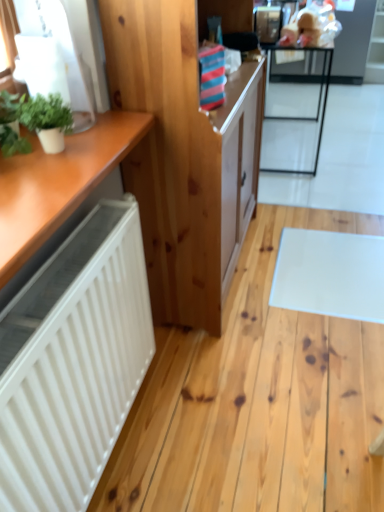
Question: Is green leafy plant at left, which is the second houseplant from right to left, to the left of green matte plant at upper left, positioned as the 2th houseplant in left-to-right order, from the viewer's perspective?

Choices:
 (A) yes
 (B) no

Answer: (A)

Question: Is green leafy plant at left, which is the second houseplant from right to left, beside green matte plant at upper left, which is the first houseplant in right-to-left order?

Choices:
 (A) yes
 (B) no

Answer: (A)

Question: Is green leafy plant at left, positioned as the 1th houseplant in left-to-right order, located outside green matte plant at upper left, positioned as the 2th houseplant in left-to-right order?

Choices:
 (A) no
 (B) yes

Answer: (B)

Question: Does green leafy plant at left, which is the second houseplant from right to left, have a larger size compared to green matte plant at upper left, positioned as the 2th houseplant in left-to-right order?

Choices:
 (A) yes
 (B) no

Answer: (A)

Question: Does green leafy plant at left, which is the second houseplant from right to left, lie behind green matte plant at upper left, which is the first houseplant in right-to-left order?

Choices:
 (A) no
 (B) yes

Answer: (B)

Question: Is green leafy plant at left, positioned as the 1th houseplant in left-to-right order, at the right side of green matte plant at upper left, which is the first houseplant in right-to-left order?

Choices:
 (A) no
 (B) yes

Answer: (A)

Question: From the image's perspective, is natural wood cabinet at center under metallic black table at upper right?

Choices:
 (A) yes
 (B) no

Answer: (A)

Question: Does natural wood cabinet at center have a larger size compared to metallic black table at upper right?

Choices:
 (A) no
 (B) yes

Answer: (B)

Question: Does natural wood cabinet at center appear on the left side of metallic black table at upper right?

Choices:
 (A) yes
 (B) no

Answer: (A)

Question: Can you confirm if natural wood cabinet at center is smaller than metallic black table at upper right?

Choices:
 (A) yes
 (B) no

Answer: (B)

Question: Considering the relative positions of natural wood cabinet at center and metallic black table at upper right in the image provided, is natural wood cabinet at center to the right of metallic black table at upper right from the viewer's perspective?

Choices:
 (A) yes
 (B) no

Answer: (B)

Question: Considering the relative sizes of natural wood cabinet at center and metallic black table at upper right in the image provided, is natural wood cabinet at center shorter than metallic black table at upper right?

Choices:
 (A) no
 (B) yes

Answer: (A)

Question: Could you tell me if metallic black table at upper right is turned towards natural wood cabinet at center?

Choices:
 (A) no
 (B) yes

Answer: (A)